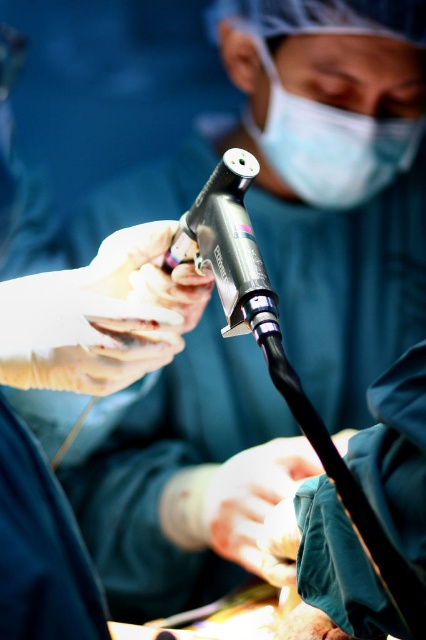
Question: Which of the following is the farthest from the observer?

Choices:
 (A) (261, 268)
 (B) (307, 141)

Answer: (B)

Question: Is metallic/smooth surgical instrument at center smaller than white matte mask at upper center?

Choices:
 (A) no
 (B) yes

Answer: (A)

Question: Is metallic/smooth surgical instrument at center smaller than white matte mask at upper center?

Choices:
 (A) no
 (B) yes

Answer: (A)

Question: In this image, where is metallic/smooth surgical instrument at center located relative to white matte mask at upper center?

Choices:
 (A) above
 (B) below

Answer: (B)